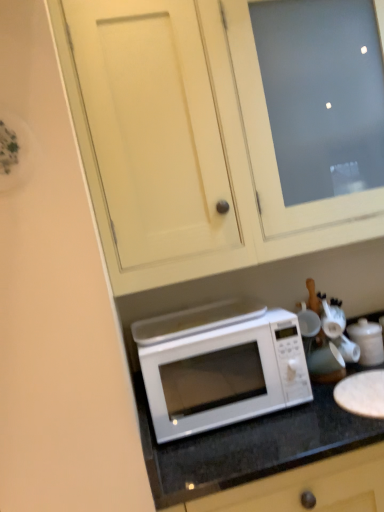
Where is `white matte cabinet at upper center`? white matte cabinet at upper center is located at coordinates (226, 130).

What do you see at coordinates (249, 446) in the screenshot?
I see `white glossy microwave at lower center` at bounding box center [249, 446].

What is the approximate height of white glossy microwave at lower center?

34.99 inches.

The height and width of the screenshot is (512, 384). Describe the element at coordinates (220, 366) in the screenshot. I see `white matte microwave at center` at that location.

What do you see at coordinates (195, 320) in the screenshot? I see `white glossy microwave at center` at bounding box center [195, 320].

Locate an element on the screen. white glossy teapot at right is located at coordinates (367, 341).

From a real-world perspective, is white matte cabinet at upper center positioned under white glossy teapot at right based on gravity?

No, from a real-world perspective, white matte cabinet at upper center is not below white glossy teapot at right.

Is point (193, 191) positioned behind point (377, 337)?

No, it is in front of (377, 337).

How many degrees apart are the facing directions of white matte cabinet at upper center and white glossy teapot at right?

There is a 0.16-degree angle between the facing directions of white matte cabinet at upper center and white glossy teapot at right.

At what (x,y) coordinates should I click in order to perform the action: click on appliance that is on the right side of white matte cabinet at upper center. Please return your answer as a coordinate pair (x, y). Looking at the image, I should click on (367, 341).

Is white matte microwave at center situated inside white glossy microwave at center or outside?

white matte microwave at center is outside white glossy microwave at center.

You are a GUI agent. You are given a task and a screenshot of the screen. Output one action in this format:
    pyautogui.click(x=<x>, y=<y>)
    Task: Click on the exhaust hood behind the white matte microwave at center
    The height and width of the screenshot is (512, 384).
    Given the screenshot: What is the action you would take?
    [195, 320]

Measure the distance from white matte microwave at center to white glossy microwave at center.

The distance of white matte microwave at center from white glossy microwave at center is 4.26 inches.

Is the depth of white matte microwave at center greater than that of white glossy microwave at center?

No.

Considering the relative positions of white glossy microwave at center and white glossy microwave at lower center in the image provided, is white glossy microwave at center to the right of white glossy microwave at lower center from the viewer's perspective?

Incorrect, white glossy microwave at center is not on the right side of white glossy microwave at lower center.

Which is behind, white glossy microwave at center or white glossy microwave at lower center?

Positioned behind is white glossy microwave at center.

From the image's perspective, relative to white glossy microwave at lower center, is white glossy microwave at center above or below?

white glossy microwave at center is situated higher than white glossy microwave at lower center in the image.

Can you tell me how much white glossy microwave at center and white glossy microwave at lower center differ in facing direction?

1.66 degrees separate the facing orientations of white glossy microwave at center and white glossy microwave at lower center.

Is point (235, 325) positioned before point (366, 342)?

That is True.

Is white matte microwave at center aimed at white glossy teapot at right?

No, white matte microwave at center does not turn towards white glossy teapot at right.

Based on the photo, measure the distance from white matte microwave at center to white glossy teapot at right.

The distance of white matte microwave at center from white glossy teapot at right is 49.12 centimeters.

Does white matte microwave at center have a lesser width compared to white glossy teapot at right?

Incorrect, the width of white matte microwave at center is not less than that of white glossy teapot at right.

Does point (365, 348) come in front of point (249, 325)?

No, it is not.

Does white glossy teapot at right turn towards white matte microwave at center?

No.

Is white glossy teapot at right taller than white matte microwave at center?

No.

Does white glossy teapot at right come behind white matte microwave at center?

Yes, it is behind white matte microwave at center.

Is white matte microwave at center aimed at white matte cabinet at upper center?

No, white matte microwave at center is not turned towards white matte cabinet at upper center.

In the scene shown: Relative to white matte cabinet at upper center, is white matte microwave at center in front or behind?

white matte microwave at center is positioned farther from the viewer than white matte cabinet at upper center.

Is white matte microwave at center bigger than white matte cabinet at upper center?

Actually, white matte microwave at center might be smaller than white matte cabinet at upper center.

Can you confirm if white matte microwave at center is positioned to the left of white matte cabinet at upper center?

Correct, you'll find white matte microwave at center to the left of white matte cabinet at upper center.

You are a GUI agent. You are given a task and a screenshot of the screen. Output one action in this format:
    pyautogui.click(x=<x>, y=<y>)
    Task: Click on the counter directly beneath the white glossy teapot at right (from a real-world perspective)
    The height and width of the screenshot is (512, 384).
    Given the screenshot: What is the action you would take?
    pyautogui.click(x=249, y=446)

In terms of height, does white glossy microwave at lower center look taller or shorter compared to white glossy teapot at right?

Considering their sizes, white glossy microwave at lower center has more height than white glossy teapot at right.

Choose the correct answer: Is white glossy microwave at lower center inside white glossy teapot at right or outside it?

white glossy microwave at lower center lies outside white glossy teapot at right.

Identify the location of cabinetry that is above the white glossy teapot at right (from the image's perspective). (226, 130).

This screenshot has height=512, width=384. In order to click on microwave oven in front of the white glossy microwave at center in this screenshot , I will do pos(220,366).

Based on their spatial positions, is white glossy teapot at right or white matte cabinet at upper center closer to white matte microwave at center?

white matte cabinet at upper center is closer to white matte microwave at center.

Which object lies further to the anchor point white matte cabinet at upper center, white glossy microwave at lower center or white glossy teapot at right?

white glossy teapot at right is further to white matte cabinet at upper center.

From the image, which object appears to be farther from white matte cabinet at upper center, white glossy microwave at center or white matte microwave at center?

white glossy microwave at center is positioned further to the anchor white matte cabinet at upper center.

Considering their positions, is white matte microwave at center positioned further to white glossy microwave at center than white glossy teapot at right?

Among the two, white glossy teapot at right is located further to white glossy microwave at center.

When comparing their distances from white glossy teapot at right, does white glossy microwave at center or white matte cabinet at upper center seem closer?

The object closer to white glossy teapot at right is white glossy microwave at center.

Considering their positions, is white matte cabinet at upper center positioned closer to white glossy microwave at lower center than white glossy microwave at center?

white glossy microwave at center lies closer to white glossy microwave at lower center than the other object.

Which object lies nearer to the anchor point white glossy teapot at right, white glossy microwave at lower center or white glossy microwave at center?

Among the two, white glossy microwave at lower center is located nearer to white glossy teapot at right.

Looking at the image, which one is located closer to white glossy microwave at lower center, white glossy teapot at right or white glossy microwave at center?

Among the two, white glossy microwave at center is located nearer to white glossy microwave at lower center.

This screenshot has width=384, height=512. I want to click on appliance between white matte cabinet at upper center and white matte microwave at center in the up-down direction, so click(x=367, y=341).

At what (x,y) coordinates should I click in order to perform the action: click on exhaust hood that lies between white matte cabinet at upper center and white glossy microwave at lower center from top to bottom. Please return your answer as a coordinate pair (x, y). This screenshot has height=512, width=384. Looking at the image, I should click on (195, 320).

This screenshot has width=384, height=512. What are the coordinates of `microwave oven between white glossy microwave at center and white glossy teapot at right in the horizontal direction` in the screenshot? It's located at (220, 366).

Where is `appliance between white matte cabinet at upper center and white glossy microwave at lower center from top to bottom`? The image size is (384, 512). appliance between white matte cabinet at upper center and white glossy microwave at lower center from top to bottom is located at coordinates (367, 341).